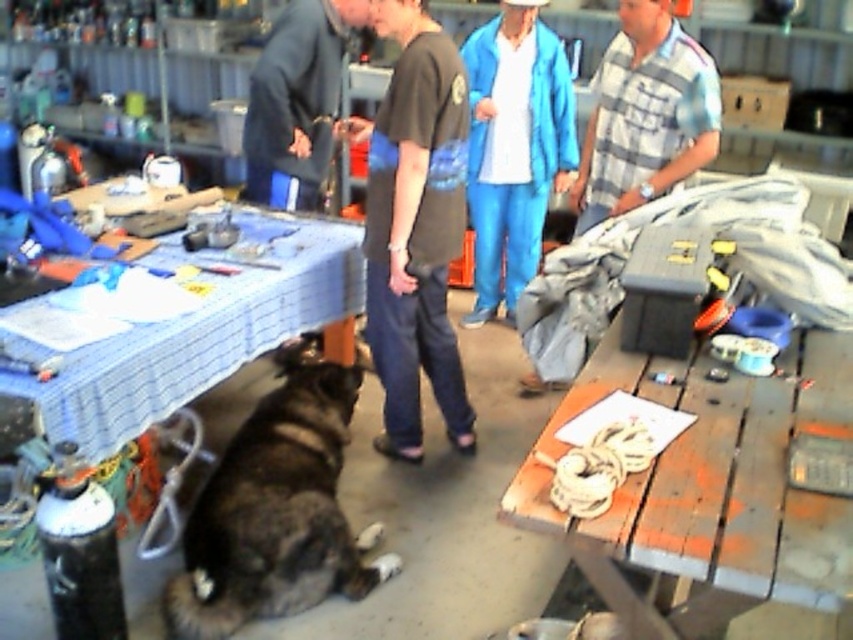
You are organizing items in a cluttered workshop. You need to place a plaid cotton shirt at upper right and a dark blue fabric at center. Which item is taller?

The plaid cotton shirt at upper right is taller than the dark blue fabric at center.

You are a tailor working in this workshop and need to access both the blue fabric pants at center and the dark blue fabric at center. Which item is positioned higher up?

The dark blue fabric at center is positioned higher up than the blue fabric pants at center.

You are standing in the workshop and see the wooden table at lower right and the blue fabric pants at center. Which object is positioned further to the right?

The wooden table at lower right is positioned further to the right than the blue fabric pants at center.